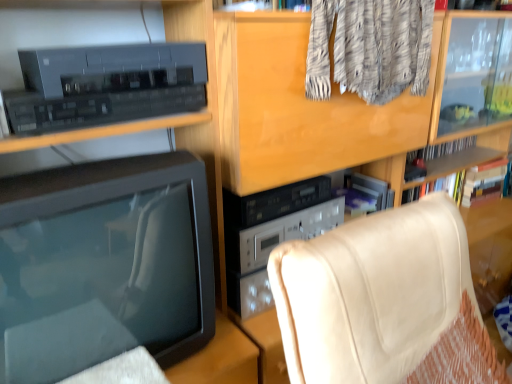
Question: Is matte black television at left bigger or smaller than beige leather chair at lower right?

Choices:
 (A) big
 (B) small

Answer: (B)

Question: Relative to beige leather chair at lower right, is matte black television at left in front or behind?

Choices:
 (A) front
 (B) behind

Answer: (B)

Question: From the image's perspective, is matte black television at left above or below beige leather chair at lower right?

Choices:
 (A) above
 (B) below

Answer: (A)

Question: Considering the relative positions of beige leather chair at lower right and matte black television at left in the image provided, is beige leather chair at lower right to the left or to the right of matte black television at left?

Choices:
 (A) left
 (B) right

Answer: (B)

Question: From their relative heights in the image, would you say beige leather chair at lower right is taller or shorter than matte black television at left?

Choices:
 (A) tall
 (B) short

Answer: (A)

Question: Is beige leather chair at lower right inside the boundaries of matte black television at left, or outside?

Choices:
 (A) outside
 (B) inside

Answer: (A)

Question: Based on their sizes in the image, would you say beige leather chair at lower right is bigger or smaller than matte black television at left?

Choices:
 (A) big
 (B) small

Answer: (A)